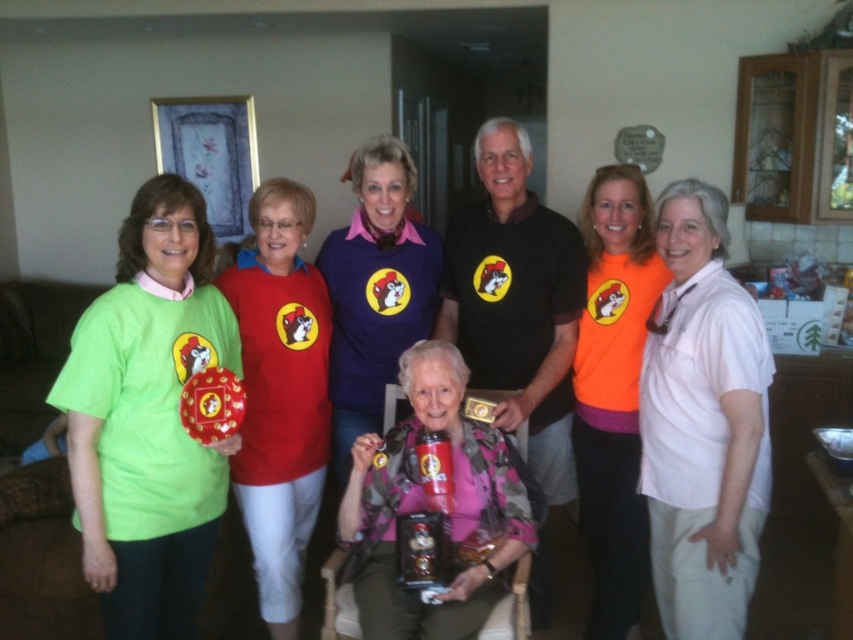
Question: Is purple cotton shirt at center to the left of green matte t-shirt at left from the viewer's perspective?

Choices:
 (A) no
 (B) yes

Answer: (B)

Question: Estimate the real-world distances between objects in this image. Which object is farther from the matte red shirt at center?

Choices:
 (A) white cotton shirt at center
 (B) matte green t-shirt at left

Answer: (A)

Question: Which of the following is the farthest from the observer?

Choices:
 (A) (96, 397)
 (B) (296, 291)

Answer: (B)

Question: Which point appears farthest from the camera in this image?

Choices:
 (A) (125, 428)
 (B) (436, 595)
 (C) (527, 173)

Answer: (C)

Question: Can you confirm if matte green t-shirt at left is positioned to the right of white cotton shirt at center?

Choices:
 (A) no
 (B) yes

Answer: (A)

Question: Can you confirm if matte red shirt at center is positioned above green matte t-shirt at left?

Choices:
 (A) yes
 (B) no

Answer: (B)